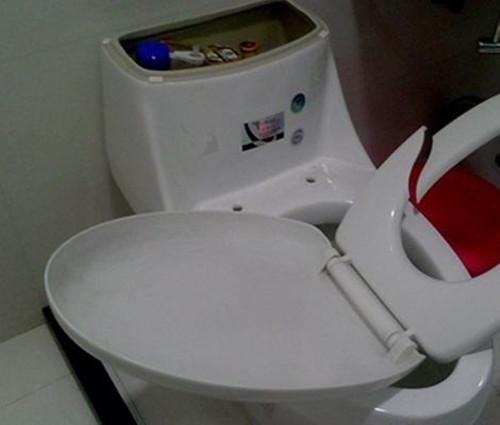
You are a GUI agent. You are given a task and a screenshot of the screen. Output one action in this format:
    pyautogui.click(x=<x>, y=<y>)
    Task: Click on the white tile flooring
    
    Given the screenshot: What is the action you would take?
    60,400